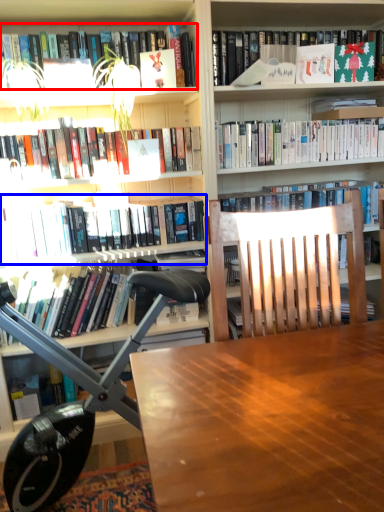
Question: Which of the following is the closest to the observer, book (highlighted by a red box) or book (highlighted by a blue box)?

Choices:
 (A) book
 (B) book

Answer: (A)